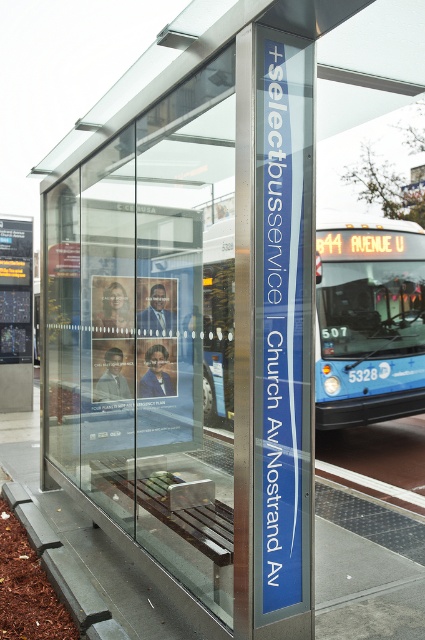
You are a delivery person who needs to load a package onto a truck parked behind the gray concrete curb at lower left. The truck has a loading ramp that can only accommodate items no taller than the curb. Can you safely load the blue metallic bus at center onto the truck without damaging the ramp?

The blue metallic bus at center is taller than the gray concrete curb at lower left. Since the loading ramp can only handle items up to the curb height, the bus cannot be loaded safely without risking damage to the ramp.

You are a person carrying a heavy backpack and need to sit down. You see the brown wooden bench at lower center and the gray concrete curb at lower left. Which one is more suitable for sitting comfortably?

The brown wooden bench at lower center is more suitable for sitting comfortably because it is designed for seating and has a smaller size compared to the gray concrete curb at lower left, which might be less comfortable due to its larger and possibly harder surface.

You are standing at the bus stop and want to sit down. Which object should you approach first to reach the brown wooden bench at lower center and the gray concrete curb at lower left?

You should approach the brown wooden bench at lower center first because it is closer to you than the gray concrete curb at lower left, which is further away.